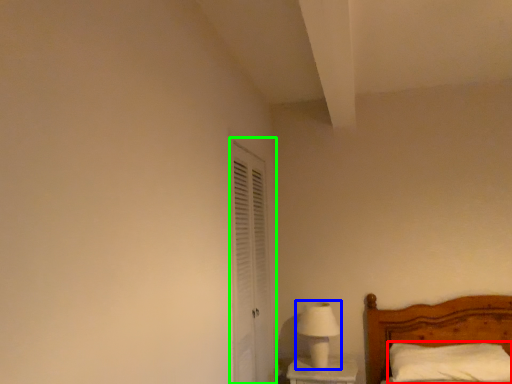
Question: Considering the real-world distances, which object is closest to pillow (highlighted by a red box)? table lamp (highlighted by a blue box) or screen door (highlighted by a green box).

Choices:
 (A) table lamp
 (B) screen door

Answer: (A)